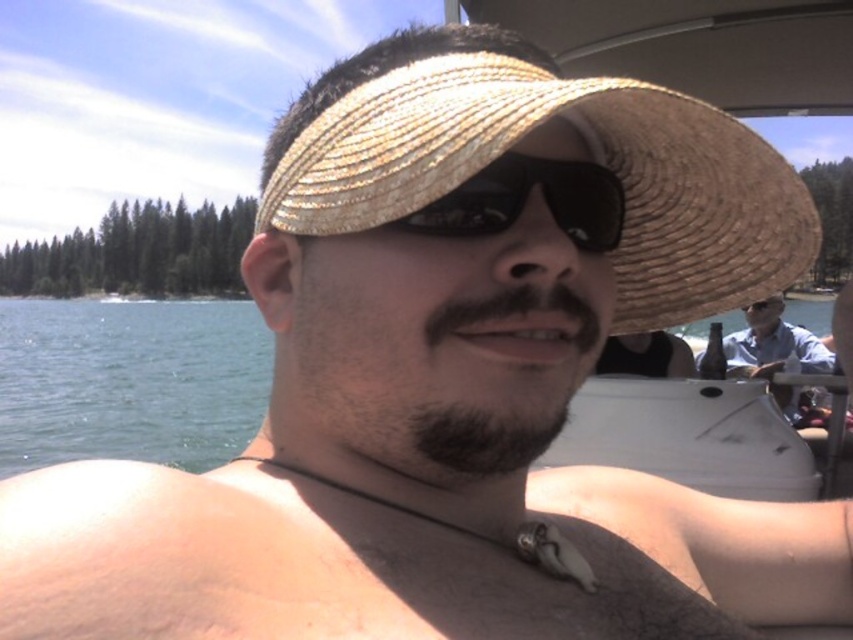
Question: Which point is farther from the camera taking this photo?

Choices:
 (A) (802, 214)
 (B) (550, 170)

Answer: (A)

Question: Considering the real-world distances, which object is closest to the straw hat at center?

Choices:
 (A) light blue shirt at right
 (B) green water at lower left
 (C) black reflective sunglasses at center
 (D) natural straw hat at center

Answer: (A)

Question: Observing the image, what is the correct spatial positioning of green water at lower left in reference to black reflective sunglasses at center?

Choices:
 (A) above
 (B) below

Answer: (B)

Question: From the image, what is the correct spatial relationship of black reflective sunglasses at center in relation to light blue shirt at right?

Choices:
 (A) above
 (B) below

Answer: (A)

Question: Based on their relative distances, which object is nearer to the black reflective sunglasses at center?

Choices:
 (A) straw hat at center
 (B) green water at lower left
 (C) light blue shirt at right

Answer: (C)

Question: Is natural straw hat at center positioned behind green water at lower left?

Choices:
 (A) no
 (B) yes

Answer: (A)